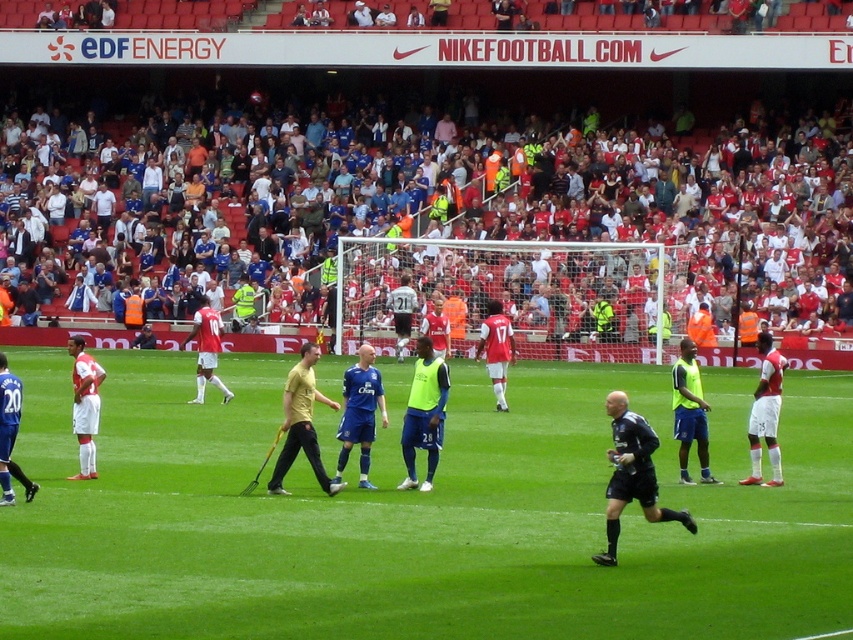
Can you confirm if red fabric crowd at upper center is bigger than neon yellow vest at center?

Indeed, red fabric crowd at upper center has a larger size compared to neon yellow vest at center.

Is point (107, 262) positioned in front of point (688, 387)?

No, (107, 262) is further to viewer.

Where is `red fabric crowd at upper center`? This screenshot has width=853, height=640. red fabric crowd at upper center is located at coordinates (430, 208).

Measure the distance between blue jersey at center and camera.

A distance of 58.19 feet exists between blue jersey at center and camera.

Does blue jersey at center have a lesser width compared to white matte shorts at right?

Indeed, blue jersey at center has a lesser width compared to white matte shorts at right.

Describe the element at coordinates (360, 412) in the screenshot. This screenshot has height=640, width=853. I see `blue jersey at center` at that location.

Locate an element on the screen. The width and height of the screenshot is (853, 640). blue jersey at center is located at coordinates (360, 412).

Can you confirm if blue jersey at center is taller than matte red jersey at center?

Indeed, blue jersey at center has a greater height compared to matte red jersey at center.

Is blue jersey at center further to the viewer compared to matte red jersey at center?

No.

Between point (347, 417) and point (480, 324), which one is positioned in front?

Point (347, 417)

Image resolution: width=853 pixels, height=640 pixels. In order to click on blue jersey at center in this screenshot , I will do `click(360, 412)`.